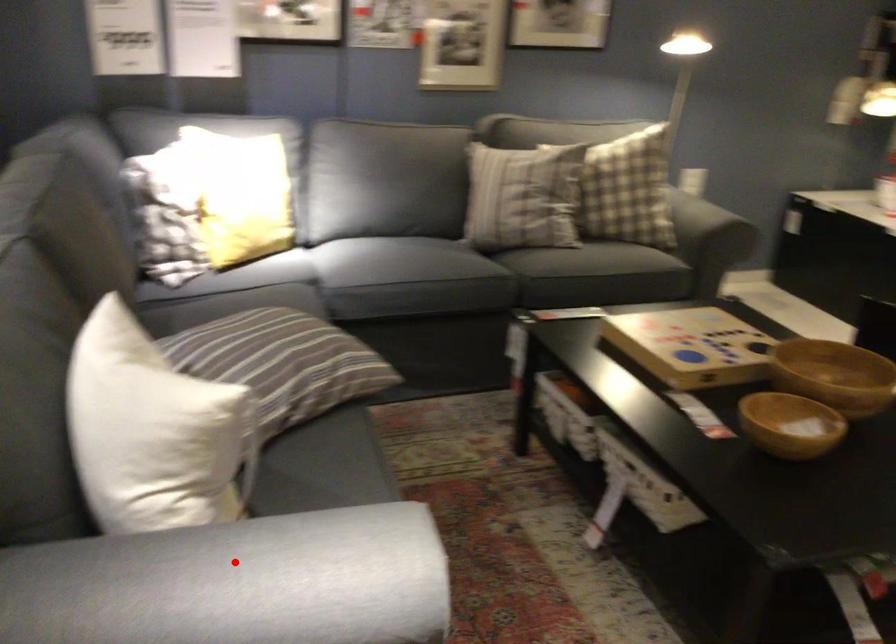
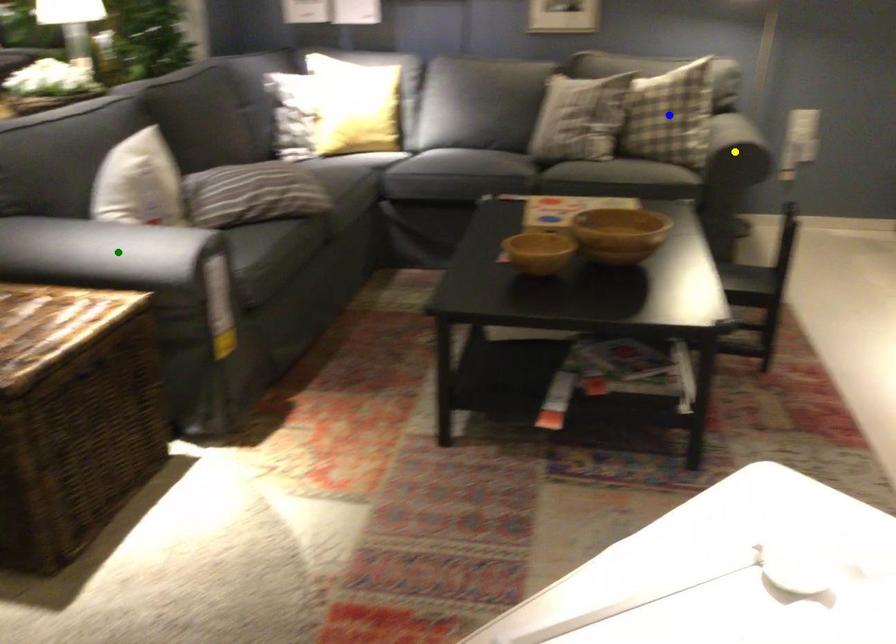
Question: I am providing you with two images of the same scene from different viewpoints. A red point is marked on the first image. You are given multiple points on the second image. Can you choose the point in image 2 that corresponds to the point in image 1?

Choices:
 (A) yellow point
 (B) blue point
 (C) green point

Answer: (C)